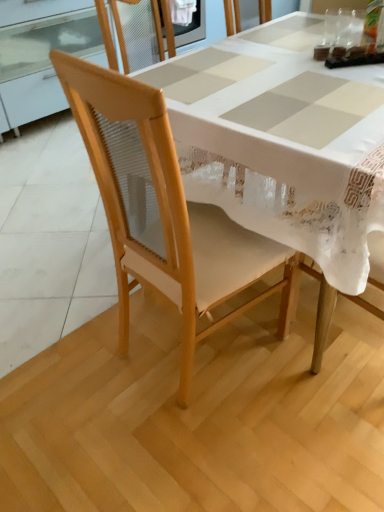
Question: From the image's perspective, would you say white fabric table at center is shown under natural wood chair at center?

Choices:
 (A) yes
 (B) no

Answer: (B)

Question: Is there a large distance between white fabric table at center and natural wood chair at center?

Choices:
 (A) no
 (B) yes

Answer: (A)

Question: Is white fabric table at center positioned in front of natural wood chair at center?

Choices:
 (A) yes
 (B) no

Answer: (B)

Question: Can you confirm if white fabric table at center is positioned to the left of natural wood chair at center?

Choices:
 (A) yes
 (B) no

Answer: (B)

Question: Is white fabric table at center not within natural wood chair at center?

Choices:
 (A) no
 (B) yes

Answer: (B)

Question: Is white fabric table at center smaller than natural wood chair at center?

Choices:
 (A) no
 (B) yes

Answer: (A)

Question: From the image's perspective, does transparent plastic cup at upper right, placed as the first tableware when sorted from left to right, appear lower than white fabric table at center?

Choices:
 (A) no
 (B) yes

Answer: (A)

Question: Does transparent plastic cup at upper right, the 2th tableware from the right, have a lesser height compared to white fabric table at center?

Choices:
 (A) no
 (B) yes

Answer: (B)

Question: Is transparent plastic cup at upper right, placed as the first tableware when sorted from left to right, to the right of white fabric table at center from the viewer's perspective?

Choices:
 (A) no
 (B) yes

Answer: (B)

Question: Is transparent plastic cup at upper right, the 2th tableware from the right, outside white fabric table at center?

Choices:
 (A) yes
 (B) no

Answer: (A)

Question: Considering the relative sizes of transparent plastic cup at upper right, placed as the first tableware when sorted from left to right, and white fabric table at center in the image provided, is transparent plastic cup at upper right, placed as the first tableware when sorted from left to right, bigger than white fabric table at center?

Choices:
 (A) no
 (B) yes

Answer: (A)

Question: Is transparent plastic cup at upper right, the 2th tableware from the right, at the left side of white fabric table at center?

Choices:
 (A) yes
 (B) no

Answer: (B)

Question: Is transparent plastic cup at upper right, placed as the first tableware when sorted from left to right, bigger than natural wood chair at center?

Choices:
 (A) yes
 (B) no

Answer: (B)